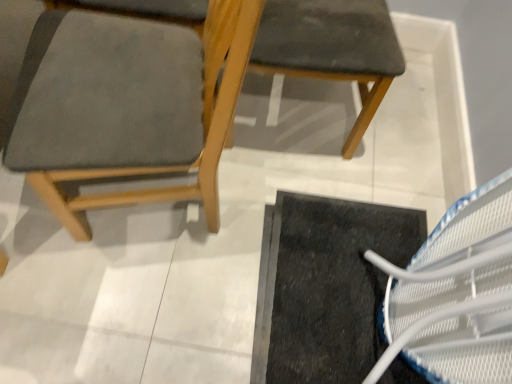
Question: Is matte gray fabric chair at left, acting as the 1th chair starting from the left, further to the viewer compared to black rubber doormat at lower right?

Choices:
 (A) yes
 (B) no

Answer: (B)

Question: Is matte gray fabric chair at left, acting as the 1th chair starting from the left, thinner than black rubber doormat at lower right?

Choices:
 (A) yes
 (B) no

Answer: (A)

Question: Is matte gray fabric chair at left, acting as the 1th chair starting from the left, closer to camera compared to black rubber doormat at lower right?

Choices:
 (A) yes
 (B) no

Answer: (A)

Question: Would you consider matte gray fabric chair at left, acting as the 1th chair starting from the left, to be distant from black rubber doormat at lower right?

Choices:
 (A) yes
 (B) no

Answer: (B)

Question: From the image's perspective, would you say matte gray fabric chair at left, which is the 2th chair from right to left, is positioned over black rubber doormat at lower right?

Choices:
 (A) yes
 (B) no

Answer: (A)

Question: Which is correct: matte gray fabric chair at left, which is the 2th chair from right to left, is inside black rubber doormat at lower right, or outside of it?

Choices:
 (A) inside
 (B) outside

Answer: (B)

Question: From a real-world perspective, is matte gray fabric chair at left, which is the 2th chair from right to left, above or below black rubber doormat at lower right?

Choices:
 (A) below
 (B) above

Answer: (B)

Question: In terms of size, does matte gray fabric chair at left, which is the 2th chair from right to left, appear bigger or smaller than black rubber doormat at lower right?

Choices:
 (A) small
 (B) big

Answer: (B)

Question: Is matte gray fabric chair at left, which is the 2th chair from right to left, wider or thinner than black rubber doormat at lower right?

Choices:
 (A) thin
 (B) wide

Answer: (A)

Question: Is matte gray fabric chair at left, acting as the 1th chair starting from the left, in front of or behind matte gray cushion at upper right, marked as the first chair in a right-to-left arrangement, in the image?

Choices:
 (A) behind
 (B) front

Answer: (B)

Question: Considering the relative positions of matte gray fabric chair at left, acting as the 1th chair starting from the left, and matte gray cushion at upper right, the 2th chair from the left, in the image provided, is matte gray fabric chair at left, acting as the 1th chair starting from the left, to the left or to the right of matte gray cushion at upper right, the 2th chair from the left,?

Choices:
 (A) left
 (B) right

Answer: (A)

Question: In terms of width, does matte gray fabric chair at left, acting as the 1th chair starting from the left, look wider or thinner when compared to matte gray cushion at upper right, the 2th chair from the left?

Choices:
 (A) thin
 (B) wide

Answer: (B)

Question: Is point (121, 201) positioned closer to the camera than point (298, 21)?

Choices:
 (A) farther
 (B) closer

Answer: (A)

Question: Does point (398, 46) appear closer or farther from the camera than point (377, 297)?

Choices:
 (A) closer
 (B) farther

Answer: (A)

Question: Which is correct: matte gray cushion at upper right, marked as the first chair in a right-to-left arrangement, is inside black rubber doormat at lower right, or outside of it?

Choices:
 (A) outside
 (B) inside

Answer: (A)